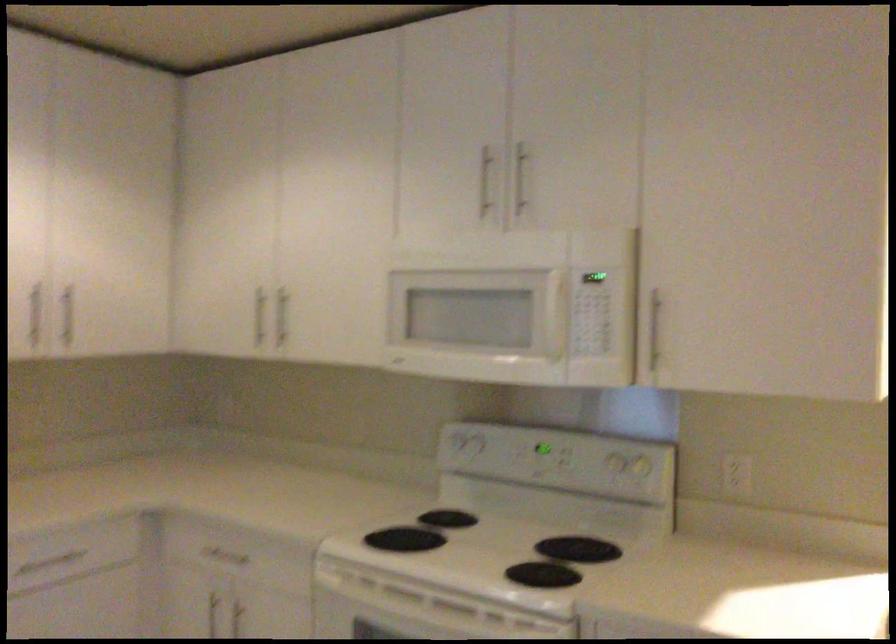
You are a GUI agent. You are given a task and a screenshot of the screen. Output one action in this format:
    pyautogui.click(x=<x>, y=<y>)
    Task: Click on the white oven handle
    The image size is (896, 644).
    Given the screenshot: What is the action you would take?
    pyautogui.click(x=554, y=315)